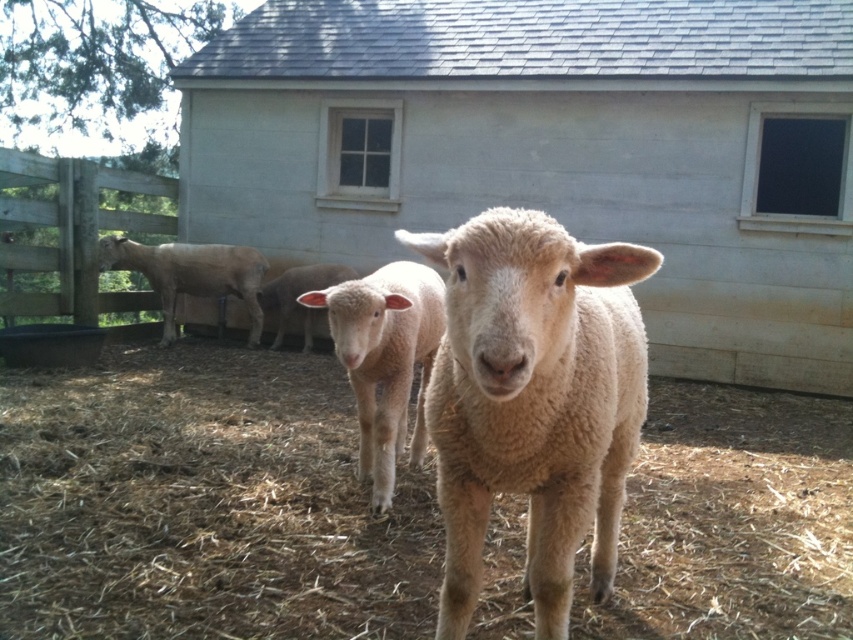
Who is more distant from viewer, (428, 300) or (65, 246)?

Positioned behind is point (65, 246).

Where is `fuzzy beige lamb at center`? This screenshot has width=853, height=640. fuzzy beige lamb at center is located at coordinates (386, 358).

What do you see at coordinates (386, 358) in the screenshot?
I see `fuzzy beige lamb at center` at bounding box center [386, 358].

I want to click on fuzzy beige lamb at center, so click(x=386, y=358).

Between fuzzy woolen sheep at center and fuzzy white lamb at center, which one appears on the left side from the viewer's perspective?

From the viewer's perspective, fuzzy white lamb at center appears more on the left side.

The height and width of the screenshot is (640, 853). What do you see at coordinates (532, 401) in the screenshot?
I see `fuzzy woolen sheep at center` at bounding box center [532, 401].

I want to click on fuzzy woolen sheep at center, so [532, 401].

Which is above, white wooden barn at center or fuzzy white lamb at center?

white wooden barn at center is higher up.

Locate an element on the screen. white wooden barn at center is located at coordinates (555, 150).